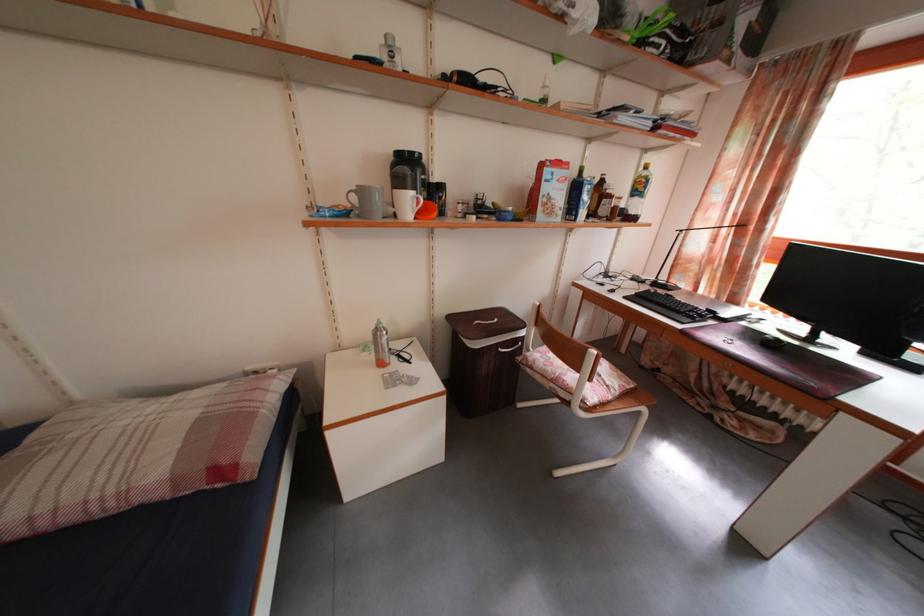
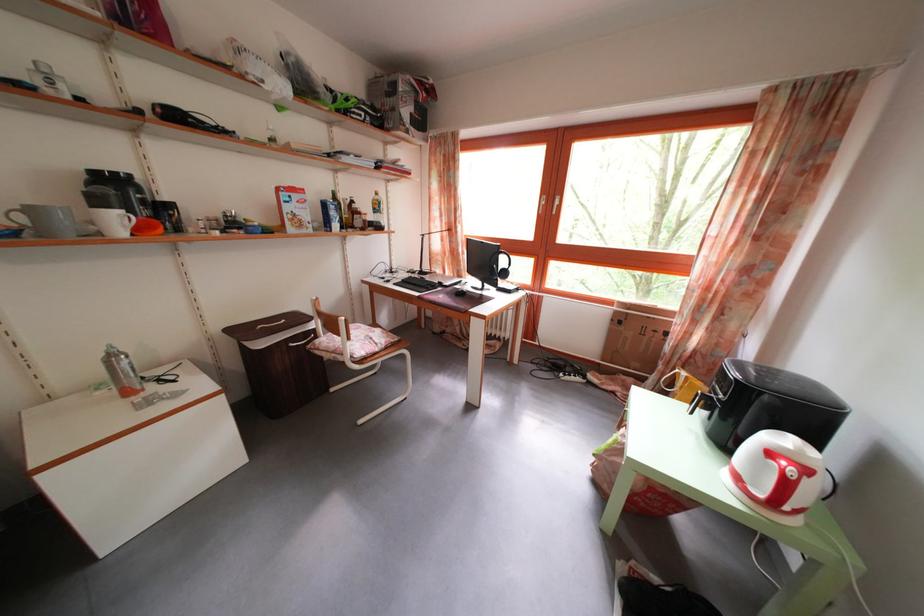
Question: Based on the continuous images, in which direction is the camera rotating? Reply with the corresponding letter.

Choices:
 (A) Left
 (B) Right
 (C) Up
 (D) Down

Answer: (B)